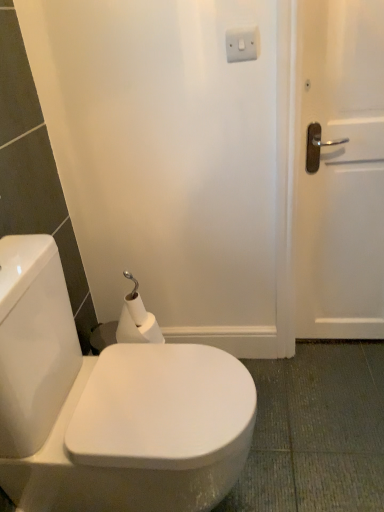
Question: From the image's perspective, is white plastic switch at upper center located above white glossy toilet at center?

Choices:
 (A) yes
 (B) no

Answer: (A)

Question: Are white plastic switch at upper center and white glossy toilet at center located far from each other?

Choices:
 (A) yes
 (B) no

Answer: (A)

Question: Is white plastic switch at upper center thinner than white glossy toilet at center?

Choices:
 (A) yes
 (B) no

Answer: (A)

Question: Does white plastic switch at upper center contain white glossy toilet at center?

Choices:
 (A) yes
 (B) no

Answer: (B)

Question: Considering the relative sizes of white plastic switch at upper center and white glossy toilet at center in the image provided, is white plastic switch at upper center bigger than white glossy toilet at center?

Choices:
 (A) no
 (B) yes

Answer: (A)

Question: Is white plastic switch at upper center wider or thinner than white matte toilet paper at lower left?

Choices:
 (A) thin
 (B) wide

Answer: (A)

Question: From the image's perspective, is white plastic switch at upper center positioned above or below white matte toilet paper at lower left?

Choices:
 (A) above
 (B) below

Answer: (A)

Question: Do you think white plastic switch at upper center is within white matte toilet paper at lower left, or outside of it?

Choices:
 (A) inside
 (B) outside

Answer: (B)

Question: Does point (244, 34) appear closer or farther from the camera than point (130, 333)?

Choices:
 (A) closer
 (B) farther

Answer: (A)

Question: From a real-world perspective, is white glossy toilet at center positioned above or below white plastic switch at upper center?

Choices:
 (A) above
 (B) below

Answer: (B)

Question: From the image's perspective, is white glossy toilet at center above or below white plastic switch at upper center?

Choices:
 (A) above
 (B) below

Answer: (B)

Question: Based on their positions, is white glossy toilet at center located to the left or right of white plastic switch at upper center?

Choices:
 (A) right
 (B) left

Answer: (B)

Question: Does point (72, 420) appear closer or farther from the camera than point (241, 30)?

Choices:
 (A) closer
 (B) farther

Answer: (A)

Question: Considering the positions of white matte toilet paper at lower left and white glossy toilet at center in the image, is white matte toilet paper at lower left bigger or smaller than white glossy toilet at center?

Choices:
 (A) big
 (B) small

Answer: (B)

Question: In the image, is white matte toilet paper at lower left on the left side or the right side of white glossy toilet at center?

Choices:
 (A) right
 (B) left

Answer: (B)